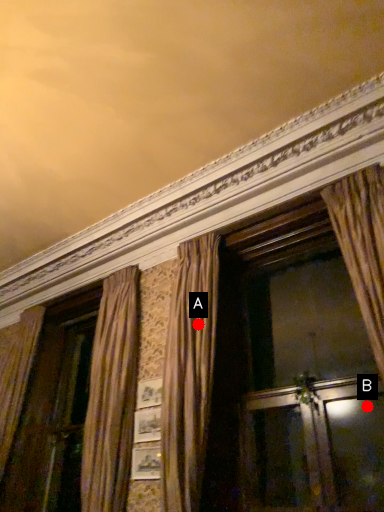
Question: Two points are circled on the image, labeled by A and B beside each circle. Which point appears farthest from the camera in this image?

Choices:
 (A) A is further
 (B) B is further

Answer: (A)